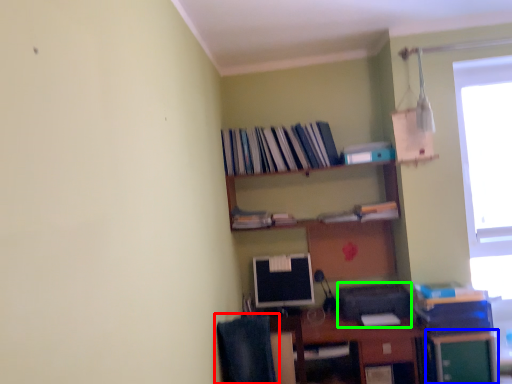
Question: Which object is the closest to the computer chair (highlighted by a red box)? Choose among these: file cabinet (highlighted by a blue box) or printer (highlighted by a green box).

Choices:
 (A) file cabinet
 (B) printer

Answer: (B)